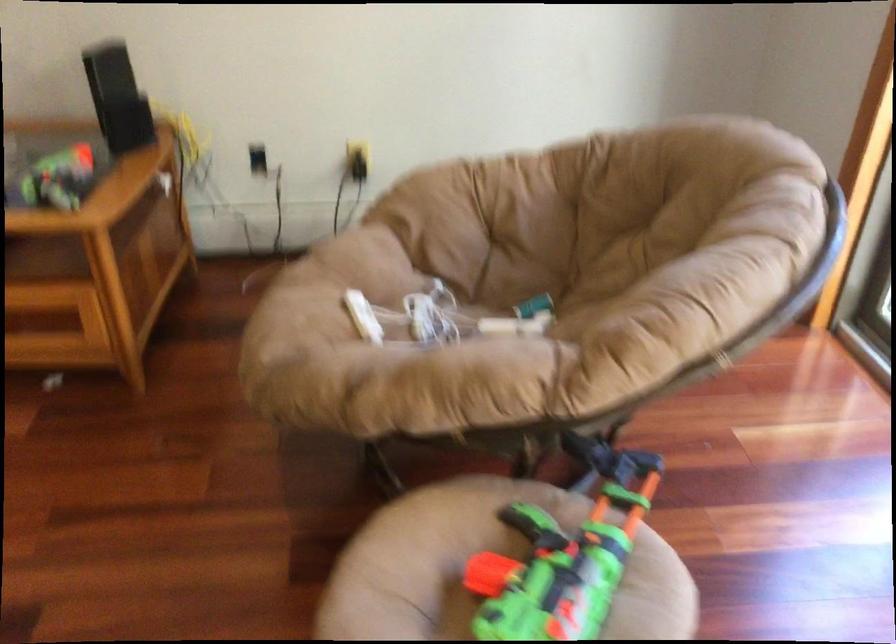
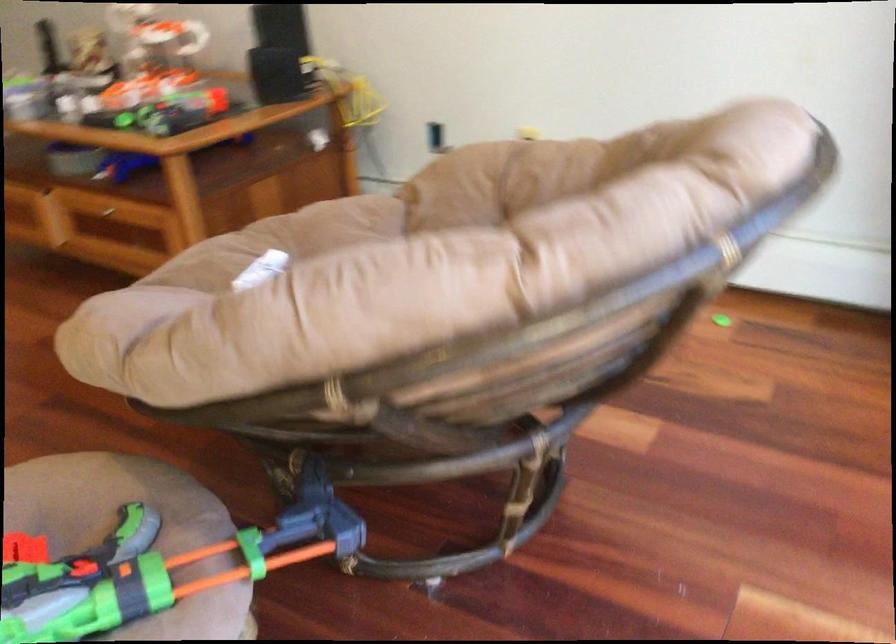
Locate, in the second image, the point that corresponds to [633,523] in the first image.

(159, 567)